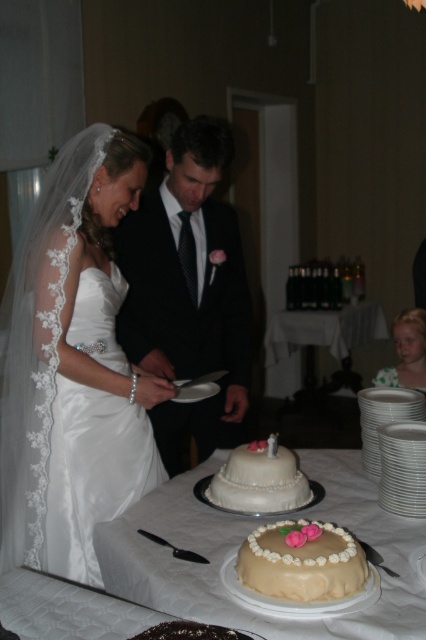
You are a photographer at the wedding. You need to adjust the lighting so that both the black satin suit at center and the white porcelain plates at center are well illuminated. Which object should you focus on first to ensure proper exposure?

The black satin suit at center is above the white porcelain plates at center, so you should focus on the black satin suit at center first to ensure proper exposure.

You are a photographer standing behind the bride and groom. You need to place a camera stand between the black satin suit at center and the white porcelain plates at center so that it is equidistant from both. Is this possible given their current positions?

The black satin suit at center and white porcelain plates at center are 2.30 meters apart. Placing the camera stand exactly halfway would require it to be 1.15 meters away from each, so yes, it is possible to position the camera stand equidistant between both objects.

You are a photographer at the wedding. You want to take a photo of the smooth beige cake at center without the satin white dress at left blocking it. Is the dress currently blocking the cake?

The satin white dress at left is positioned over smooth beige cake at center, so yes, the dress is blocking the cake and would appear in front of it in the photo.